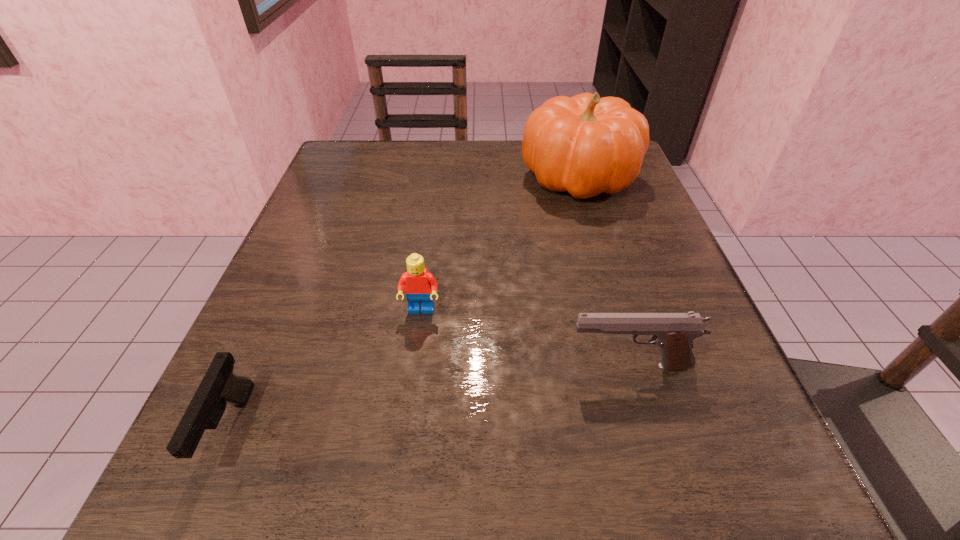
Where is `vacant area at the far edge`? Image resolution: width=960 pixels, height=540 pixels. vacant area at the far edge is located at coordinates (464, 154).

The height and width of the screenshot is (540, 960). In order to click on vacant region at the near edge in this screenshot , I will do `click(631, 501)`.

The image size is (960, 540). Find the location of `free space at the left edge`. free space at the left edge is located at coordinates (313, 377).

This screenshot has height=540, width=960. What are the coordinates of `vacant space at the right edge` in the screenshot? It's located at (577, 200).

The width and height of the screenshot is (960, 540). In the image, there is a desktop. Identify the location of vacant space at the far left corner. (394, 175).

In the image, there is a desktop. Identify the location of vacant space at the near left corner. (237, 472).

In order to click on blank area at the near right corner in this screenshot , I will do `click(730, 516)`.

Locate an element on the screen. The height and width of the screenshot is (540, 960). unoccupied area between the Lego and the pumpkin is located at coordinates (500, 244).

Where is `free spot between the farthest object and the shorter pistol`? The height and width of the screenshot is (540, 960). free spot between the farthest object and the shorter pistol is located at coordinates (404, 303).

The height and width of the screenshot is (540, 960). I want to click on empty space that is in between the Lego and the pumpkin, so click(500, 244).